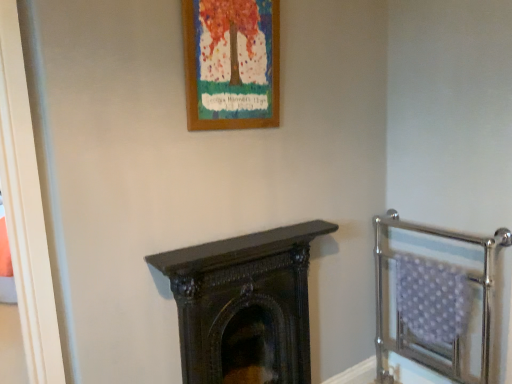
Question: Is dark wood fireplace at center inside polished chrome balustrade at right?

Choices:
 (A) yes
 (B) no

Answer: (B)

Question: Is polished chrome balustrade at right turned away from dark wood fireplace at center?

Choices:
 (A) yes
 (B) no

Answer: (B)

Question: Could you tell me if polished chrome balustrade at right is turned towards dark wood fireplace at center?

Choices:
 (A) yes
 (B) no

Answer: (A)

Question: Is polished chrome balustrade at right outside of dark wood fireplace at center?

Choices:
 (A) no
 (B) yes

Answer: (B)

Question: Can you confirm if polished chrome balustrade at right is smaller than dark wood fireplace at center?

Choices:
 (A) no
 (B) yes

Answer: (A)

Question: Does point (439, 261) appear closer or farther from the camera than point (238, 64)?

Choices:
 (A) closer
 (B) farther

Answer: (B)

Question: Do you think polished chrome balustrade at right is within wooden frame at upper center, or outside of it?

Choices:
 (A) inside
 (B) outside

Answer: (B)

Question: Considering the positions of polished chrome balustrade at right and wooden frame at upper center in the image, is polished chrome balustrade at right wider or thinner than wooden frame at upper center?

Choices:
 (A) thin
 (B) wide

Answer: (B)

Question: From their relative heights in the image, would you say polished chrome balustrade at right is taller or shorter than wooden frame at upper center?

Choices:
 (A) short
 (B) tall

Answer: (B)

Question: From their relative heights in the image, would you say dark wood fireplace at center is taller or shorter than polished chrome balustrade at right?

Choices:
 (A) short
 (B) tall

Answer: (A)

Question: In terms of width, does dark wood fireplace at center look wider or thinner when compared to polished chrome balustrade at right?

Choices:
 (A) wide
 (B) thin

Answer: (B)

Question: Looking at the image, does dark wood fireplace at center seem bigger or smaller compared to polished chrome balustrade at right?

Choices:
 (A) small
 (B) big

Answer: (A)

Question: Based on their positions, is dark wood fireplace at center located to the left or right of polished chrome balustrade at right?

Choices:
 (A) right
 (B) left

Answer: (B)

Question: Considering the positions of wooden frame at upper center and dark wood fireplace at center in the image, is wooden frame at upper center bigger or smaller than dark wood fireplace at center?

Choices:
 (A) big
 (B) small

Answer: (B)

Question: In the image, is wooden frame at upper center on the left side or the right side of dark wood fireplace at center?

Choices:
 (A) right
 (B) left

Answer: (B)